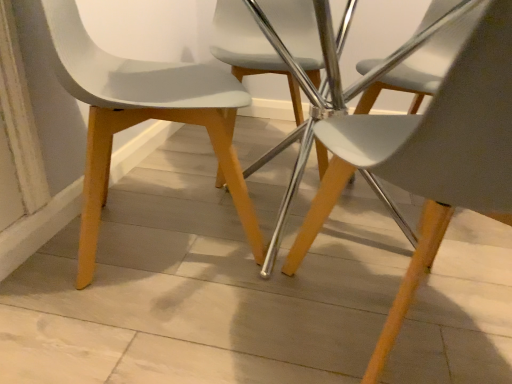
Locate an element on the screen. The width and height of the screenshot is (512, 384). vacant space behind matte white chair at left, placed as the second chair when sorted from back to front is located at coordinates (165, 174).